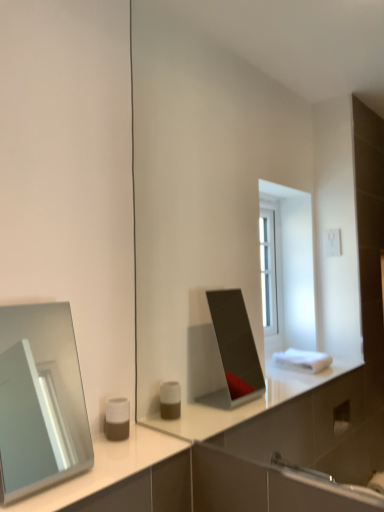
Question: Should I look upward or downward to see matte white and brown cylindrical container at lower left?

Choices:
 (A) up
 (B) down

Answer: (B)

Question: Is matte white and brown cylindrical container at lower left to the left of silver metallic mirror at left from the viewer's perspective?

Choices:
 (A) yes
 (B) no

Answer: (B)

Question: Considering the relative sizes of matte white and brown cylindrical container at lower left and silver metallic mirror at left in the image provided, is matte white and brown cylindrical container at lower left smaller than silver metallic mirror at left?

Choices:
 (A) no
 (B) yes

Answer: (B)

Question: Is silver metallic mirror at left a part of matte white and brown cylindrical container at lower left?

Choices:
 (A) no
 (B) yes

Answer: (A)

Question: From a real-world perspective, is matte white and brown cylindrical container at lower left located beneath silver metallic mirror at left?

Choices:
 (A) no
 (B) yes

Answer: (B)

Question: Considering the relative sizes of matte white and brown cylindrical container at lower left and silver metallic mirror at left in the image provided, is matte white and brown cylindrical container at lower left thinner than silver metallic mirror at left?

Choices:
 (A) yes
 (B) no

Answer: (A)

Question: Does matte white and brown cylindrical container at lower left have a lesser height compared to silver metallic mirror at left?

Choices:
 (A) no
 (B) yes

Answer: (B)

Question: Does silver metallic mirror at left have a lesser height compared to matte white and brown cylindrical container at lower left?

Choices:
 (A) yes
 (B) no

Answer: (B)

Question: Is silver metallic mirror at left at the left side of matte white and brown cylindrical container at lower left?

Choices:
 (A) no
 (B) yes

Answer: (B)

Question: Could matte white and brown cylindrical container at lower left be considered to be inside silver metallic mirror at left?

Choices:
 (A) yes
 (B) no

Answer: (B)

Question: Is silver metallic mirror at left next to matte white and brown cylindrical container at lower left?

Choices:
 (A) yes
 (B) no

Answer: (B)

Question: Is silver metallic mirror at left oriented away from matte white and brown cylindrical container at lower left?

Choices:
 (A) yes
 (B) no

Answer: (B)

Question: From the image's perspective, is silver metallic mirror at left over matte white and brown cylindrical container at lower left?

Choices:
 (A) yes
 (B) no

Answer: (A)

Question: Visually, is matte white and brown cylindrical container at lower left positioned to the left or to the right of silver metallic mirror at left?

Choices:
 (A) right
 (B) left

Answer: (A)